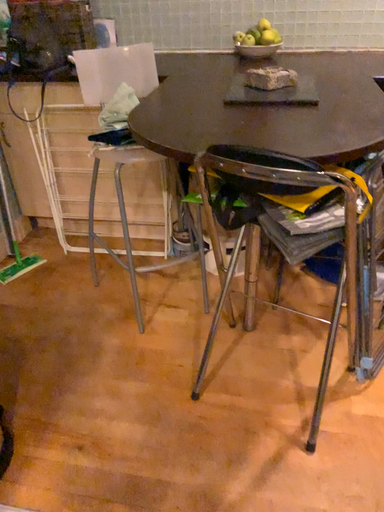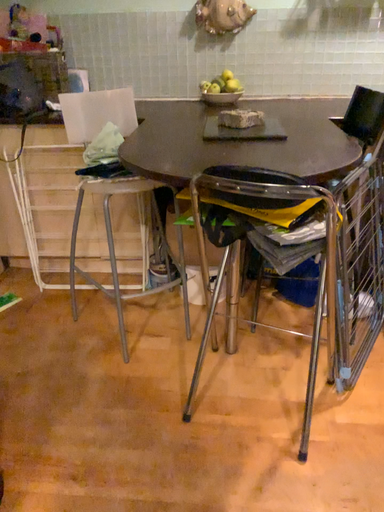
Question: Which way did the camera rotate in the video?

Choices:
 (A) rotated upward
 (B) rotated downward

Answer: (A)